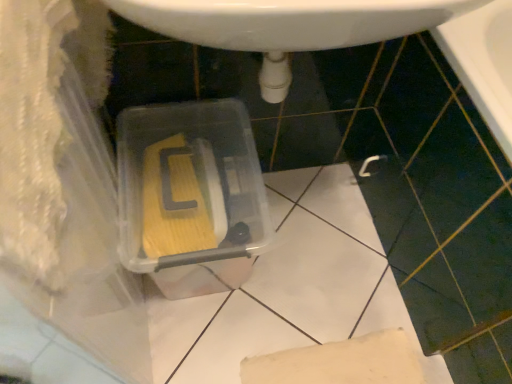
I want to click on white glossy sink at center, so click(x=288, y=26).

What do you see at coordinates (288, 26) in the screenshot?
I see `white glossy sink at center` at bounding box center [288, 26].

What do you see at coordinates (190, 195) in the screenshot? I see `transparent plastic storage box at center` at bounding box center [190, 195].

This screenshot has width=512, height=384. What are the coordinates of `transparent plastic storage box at center` in the screenshot? It's located at (190, 195).

The height and width of the screenshot is (384, 512). I want to click on white glossy sink at center, so click(x=288, y=26).

Considering the positions of objects white glossy sink at center and transparent plastic storage box at center in the image provided, who is more to the right, white glossy sink at center or transparent plastic storage box at center?

From the viewer's perspective, white glossy sink at center appears more on the right side.

Is white glossy sink at center in front of or behind transparent plastic storage box at center in the image?

Visually, white glossy sink at center is located in front of transparent plastic storage box at center.

Which is further, (415,3) or (182,274)?

The point (182,274) is farther.

From the image's perspective, is white glossy sink at center located beneath transparent plastic storage box at center?

No, from the image's perspective, white glossy sink at center is not beneath transparent plastic storage box at center.

From a real-world perspective, which is physically below, white glossy sink at center or transparent plastic storage box at center?

From a 3D spatial view, transparent plastic storage box at center is below.

Considering the sizes of objects white glossy sink at center and transparent plastic storage box at center in the image provided, who is thinner, white glossy sink at center or transparent plastic storage box at center?

Thinner between the two is white glossy sink at center.

Does white glossy sink at center have a lesser height compared to transparent plastic storage box at center?

Yes.

Can you confirm if white glossy sink at center is smaller than transparent plastic storage box at center?

Yes.

Is white glossy sink at center not inside transparent plastic storage box at center?

Yes.

Does white glossy sink at center touch transparent plastic storage box at center?

There is a gap between white glossy sink at center and transparent plastic storage box at center.

Is white glossy sink at center facing away from transparent plastic storage box at center?

No.

Locate an element on the screen. storage box behind the white glossy sink at center is located at coordinates (190, 195).

Is transparent plastic storage box at center to the left of white glossy sink at center from the viewer's perspective?

Indeed, transparent plastic storage box at center is positioned on the left side of white glossy sink at center.

Which object is closer to the camera, transparent plastic storage box at center or white glossy sink at center?

white glossy sink at center is more forward.

Which is behind, point (167, 251) or point (344, 36)?

The point (167, 251) is more distant.

In the scene shown: From the image's perspective, between transparent plastic storage box at center and white glossy sink at center, which one is located above?

From the image's view, white glossy sink at center is above.

From a real-world perspective, which is physically below, transparent plastic storage box at center or white glossy sink at center?

transparent plastic storage box at center.

Based on the photo, which of these two, transparent plastic storage box at center or white glossy sink at center, is thinner?

With smaller width is white glossy sink at center.

Who is shorter, transparent plastic storage box at center or white glossy sink at center?

white glossy sink at center is shorter.

Which of these two, transparent plastic storage box at center or white glossy sink at center, is bigger?

Bigger between the two is transparent plastic storage box at center.

Is transparent plastic storage box at center not within white glossy sink at center?

Yes, transparent plastic storage box at center is not within white glossy sink at center.

Is transparent plastic storage box at center directly adjacent to white glossy sink at center?

They are not placed beside each other.

Is white glossy sink at center at the back of transparent plastic storage box at center?

No, white glossy sink at center is not at the back of transparent plastic storage box at center.

What's the angular difference between transparent plastic storage box at center and white glossy sink at center's facing directions?

There is a 0.00153-degree angle between the facing directions of transparent plastic storage box at center and white glossy sink at center.

The height and width of the screenshot is (384, 512). In order to click on sink that appears on the right of transparent plastic storage box at center in this screenshot , I will do `click(288, 26)`.

In the image, there is a transparent plastic storage box at center. Where is `sink above it (from the image's perspective)`? sink above it (from the image's perspective) is located at coordinates (288, 26).

This screenshot has height=384, width=512. What are the coordinates of `sink that appears on the right of transparent plastic storage box at center` in the screenshot? It's located at (288, 26).